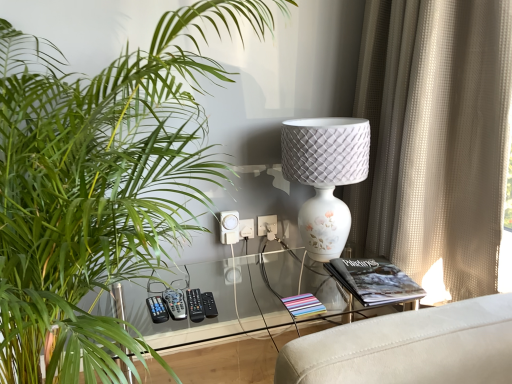
Question: Is point (195, 321) positioned closer to the camera than point (339, 274)?

Choices:
 (A) farther
 (B) closer

Answer: (B)

Question: Is black plastic remote at center, the second control from the right, in front of or behind black matte book at right in the image?

Choices:
 (A) front
 (B) behind

Answer: (A)

Question: Based on their relative distances, which object is nearer to the white plastic electric outlet at center, which is the 2th electric outlet from left to right?

Choices:
 (A) white plastic electric outlet at center, which is counted as the 1th electric outlet, starting from the left
 (B) beige textured curtain at right
 (C) transparent glass table at center
 (D) black matte book at right
 (E) green leafy plant at left

Answer: (A)

Question: Considering the real-world distances, which object is farthest from the beige textured curtain at right?

Choices:
 (A) black plastic remote at center, marked as the third control in a left-to-right arrangement
 (B) transparent glass table at center
 (C) black matte book at right
 (D) white plastic electric outlet at center, which is the 2th electric outlet from left to right
 (E) black plastic remote at center, which appears as the 2th control when viewed from the left

Answer: (E)